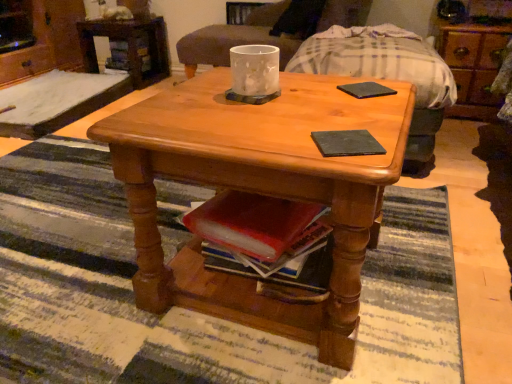
Identify the location of empty space that is in between translucent glass candle at center and black matte pad at center, the 1th pad in the right-to-left sequence. (311, 93).